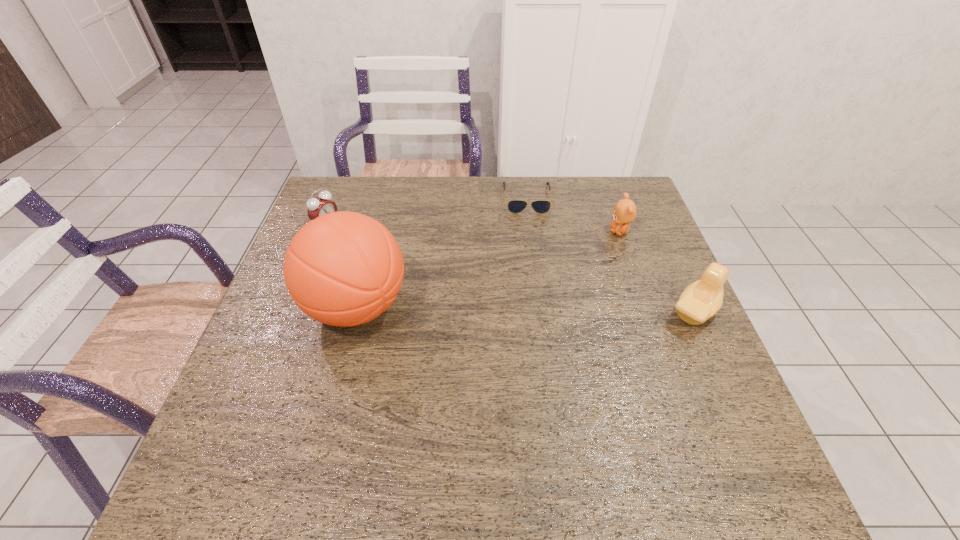
The width and height of the screenshot is (960, 540). What are the coordinates of `object that is the fourth closest to the alarm clock` in the screenshot? It's located at (702, 299).

At what (x,y) coordinates should I click in order to perform the action: click on free spot that satisfies the following two spatial constraints: 1. on the front side of the shortest object; 2. at the beak of the rightmost object. Please return your answer as a coordinate pair (x, y). The width and height of the screenshot is (960, 540). Looking at the image, I should click on (541, 312).

The image size is (960, 540). What are the coordinates of `free space that satisfies the following two spatial constraints: 1. on the front side of the rightmost object; 2. at the beak of the teddy bear` in the screenshot? It's located at 647,312.

You are a GUI agent. You are given a task and a screenshot of the screen. Output one action in this format:
    pyautogui.click(x=<x>, y=<y>)
    Task: Click on the vacant space that satisfies the following two spatial constraints: 1. on the front side of the alarm clock; 2. at the beak of the duck
    
    Given the screenshot: What is the action you would take?
    pyautogui.click(x=292, y=312)

Find the location of a particular element. This screenshot has width=960, height=540. vacant area that satisfies the following two spatial constraints: 1. on the back side of the shortest object; 2. on the left side of the tallest object is located at coordinates (385, 198).

The height and width of the screenshot is (540, 960). In order to click on free space that satisfies the following two spatial constraints: 1. on the front side of the duck; 2. at the beak of the tallest object in this screenshot , I will do `click(355, 312)`.

Where is `vacant space that satisfies the following two spatial constraints: 1. on the front side of the alarm clock; 2. on the right side of the basketball`? The width and height of the screenshot is (960, 540). vacant space that satisfies the following two spatial constraints: 1. on the front side of the alarm clock; 2. on the right side of the basketball is located at coordinates (294, 307).

Where is `free space that satisfies the following two spatial constraints: 1. on the back side of the alarm clock; 2. on the left side of the third object from right to left`? free space that satisfies the following two spatial constraints: 1. on the back side of the alarm clock; 2. on the left side of the third object from right to left is located at coordinates (337, 198).